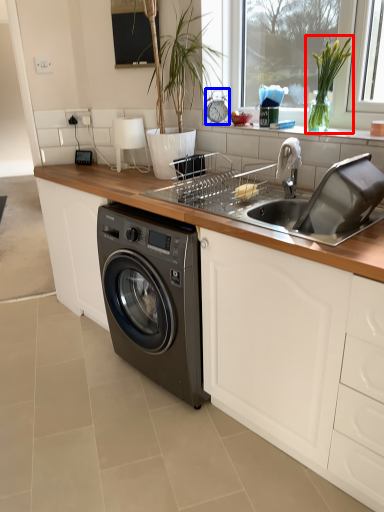
Question: Which point is closer to the camera, plant (highlighted by a red box) or appliance (highlighted by a blue box)?

Choices:
 (A) plant
 (B) appliance

Answer: (A)